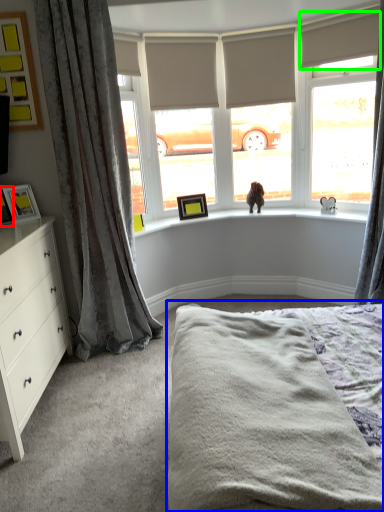
Question: Considering the real-world distances, which object is closest to picture frame (highlighted by a red box)? bed (highlighted by a blue box) or blind (highlighted by a green box).

Choices:
 (A) bed
 (B) blind

Answer: (A)